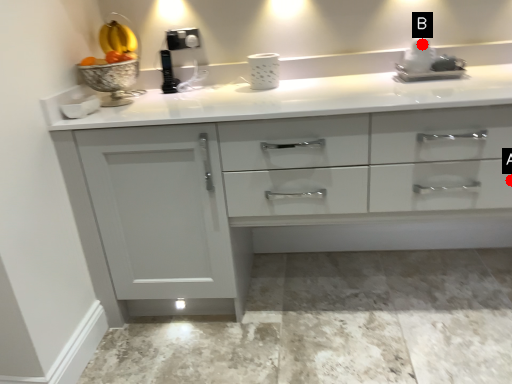
Question: Two points are circled on the image, labeled by A and B beside each circle. Which point is farther to the camera?

Choices:
 (A) A is further
 (B) B is further

Answer: (B)